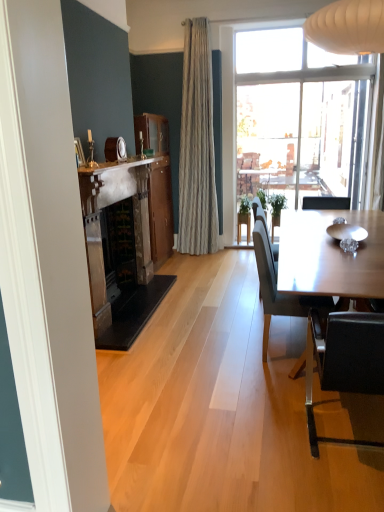
The width and height of the screenshot is (384, 512). What are the coordinates of `free space in front of dark gray fabric chair at right, positioned as the 1th chair in back-to-front order` in the screenshot? It's located at (274, 392).